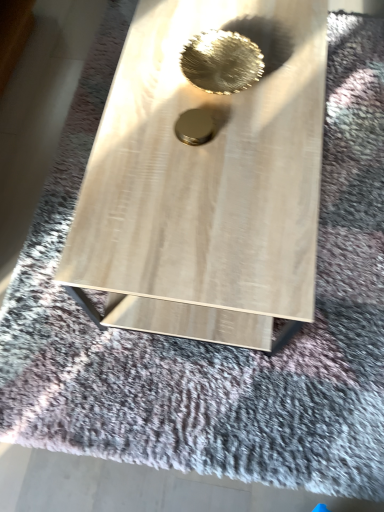
The width and height of the screenshot is (384, 512). I want to click on vacant region to the left of metallic gold bowl at center, acting as the 2th hole starting from the bottom, so point(150,77).